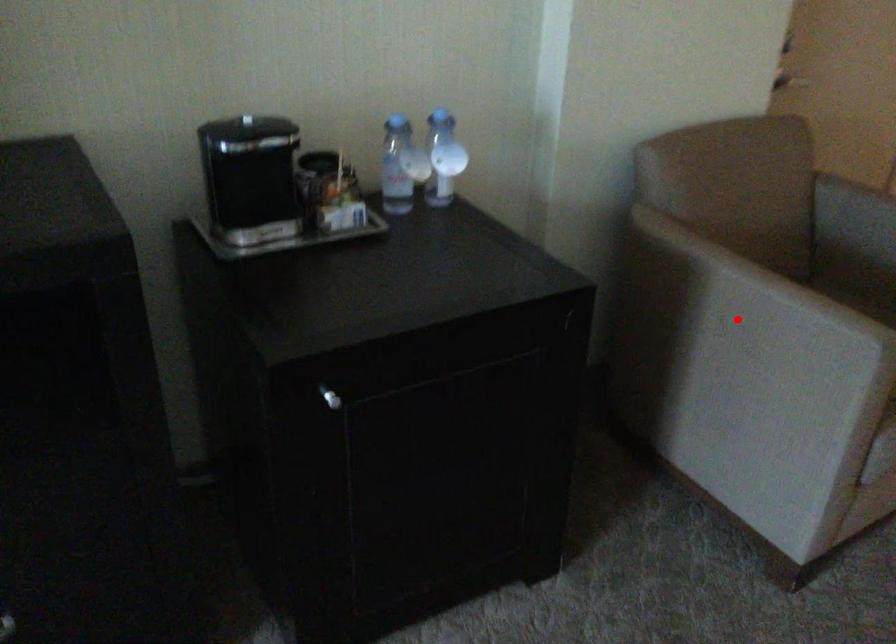
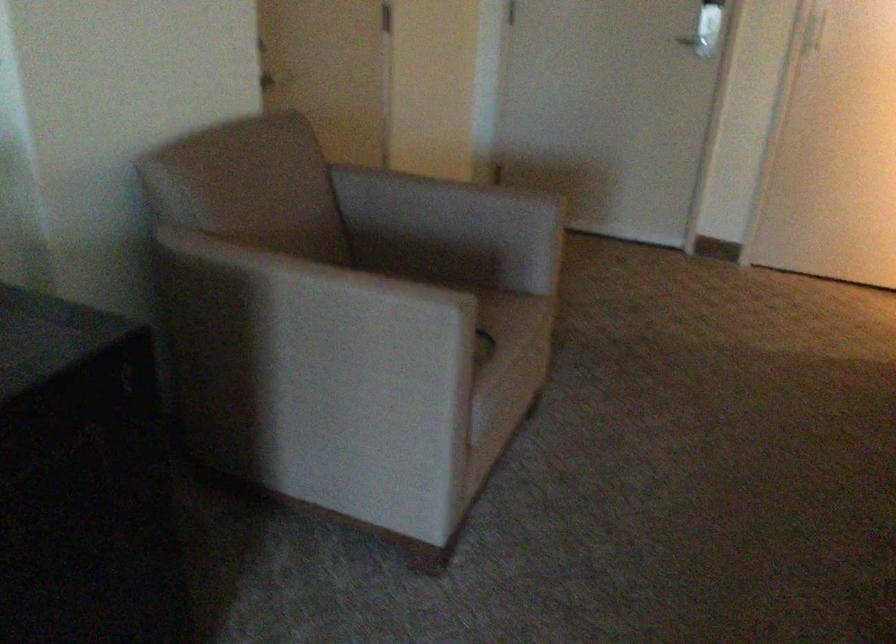
Question: I am providing you with two images of the same scene from different viewpoints. A red point is marked on the first image. Is the red point's position out of view in image 2?

Choices:
 (A) Yes
 (B) No

Answer: (B)